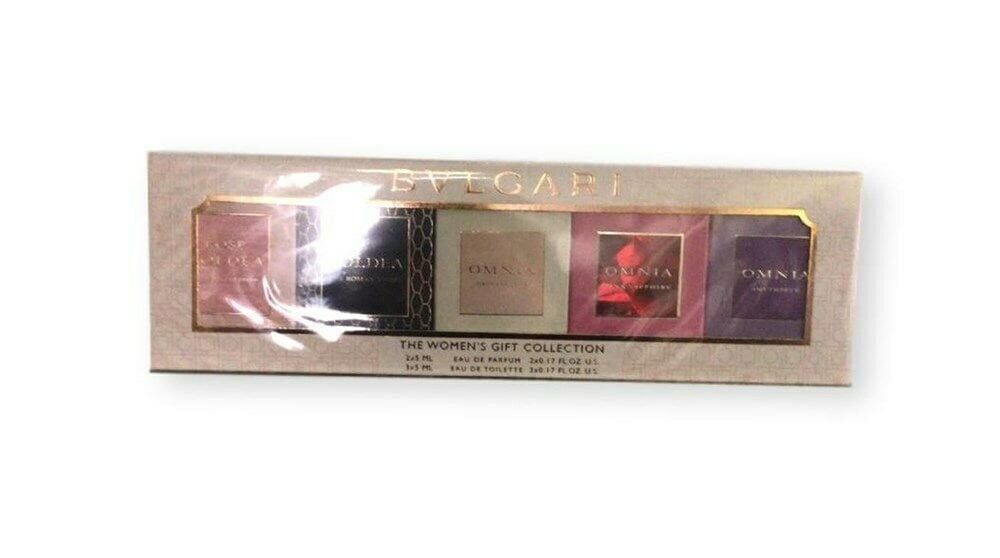
This screenshot has width=1000, height=558. What are the coordinates of `box` in the screenshot? It's located at [x=420, y=321].